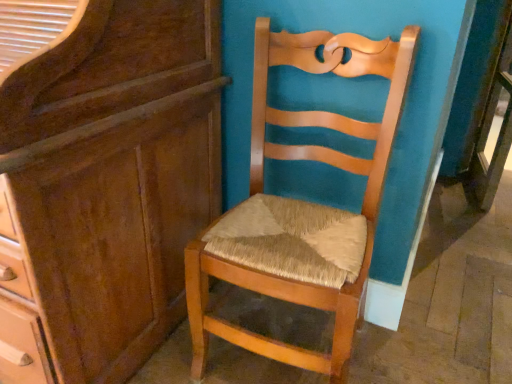
Question: Considering the positions of matte brown cabinet at left and natural wood chair at center in the image, is matte brown cabinet at left wider or thinner than natural wood chair at center?

Choices:
 (A) thin
 (B) wide

Answer: (B)

Question: From their relative heights in the image, would you say matte brown cabinet at left is taller or shorter than natural wood chair at center?

Choices:
 (A) tall
 (B) short

Answer: (A)

Question: Is matte brown cabinet at left inside or outside of natural wood chair at center?

Choices:
 (A) outside
 (B) inside

Answer: (A)

Question: Looking at their shapes, would you say natural wood chair at center is wider or thinner than matte brown cabinet at left?

Choices:
 (A) wide
 (B) thin

Answer: (B)

Question: In terms of size, does natural wood chair at center appear bigger or smaller than matte brown cabinet at left?

Choices:
 (A) small
 (B) big

Answer: (A)

Question: From the image's perspective, is natural wood chair at center positioned above or below matte brown cabinet at left?

Choices:
 (A) below
 (B) above

Answer: (A)

Question: From a real-world perspective, is natural wood chair at center physically located above or below matte brown cabinet at left?

Choices:
 (A) above
 (B) below

Answer: (B)